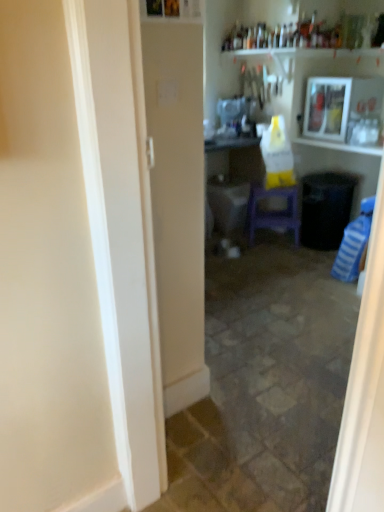
Describe the element at coordinates (273, 212) in the screenshot. I see `purple plastic stool at center` at that location.

Locate an element on the screen. wooden framed picture at upper right is located at coordinates (341, 95).

From a real-world perspective, which is physically below, wooden framed picture at upper right or white glossy sink at center?

white glossy sink at center.

Is wooden framed picture at upper right further to camera compared to white glossy sink at center?

No, the depth of wooden framed picture at upper right is less than that of white glossy sink at center.

Could you tell me if wooden framed picture at upper right is turned towards white glossy sink at center?

No, wooden framed picture at upper right does not turn towards white glossy sink at center.

Is wooden framed picture at upper right located outside white glossy sink at center?

Yes.

Would you say wooden framed picture at upper right is inside or outside purple plastic stool at center?

The correct answer is: outside.

Where is `shelf that appears in front of the purple plastic stool at center`? shelf that appears in front of the purple plastic stool at center is located at coordinates (341, 95).

From a real-world perspective, relative to purple plastic stool at center, is wooden framed picture at upper right vertically above or below?

Clearly, from a real-world perspective, wooden framed picture at upper right is above purple plastic stool at center.

Who is more distant, wooden framed picture at upper right or purple plastic stool at center?

purple plastic stool at center is behind.

From the image's perspective, who appears lower, purple plastic stool at center or wooden framed picture at upper right?

purple plastic stool at center.

In the image, is purple plastic stool at center on the left side or the right side of wooden framed picture at upper right?

purple plastic stool at center is positioned on wooden framed picture at upper right's left side.

Considering the relative sizes of purple plastic stool at center and wooden framed picture at upper right in the image provided, is purple plastic stool at center smaller than wooden framed picture at upper right?

Yes, purple plastic stool at center is smaller than wooden framed picture at upper right.

Is purple plastic stool at center far from wooden framed picture at upper right?

No.

Which is more to the left, white glossy sink at center or purple plastic stool at center?

Positioned to the left is white glossy sink at center.

In the scene shown: Between white glossy sink at center and purple plastic stool at center, which one is positioned behind?

purple plastic stool at center is further away from the camera.

Considering the sizes of objects white glossy sink at center and purple plastic stool at center in the image provided, who is shorter, white glossy sink at center or purple plastic stool at center?

white glossy sink at center.

In the scene shown: Can we say white glossy sink at center lies outside wooden framed picture at upper right?

That's correct, white glossy sink at center is outside of wooden framed picture at upper right.

Can you confirm if white glossy sink at center is positioned to the left of wooden framed picture at upper right?

Indeed, white glossy sink at center is positioned on the left side of wooden framed picture at upper right.

From the image's perspective, is white glossy sink at center above or below wooden framed picture at upper right?

white glossy sink at center is below wooden framed picture at upper right.

Can you confirm if white glossy sink at center is smaller than wooden framed picture at upper right?

Correct, white glossy sink at center occupies less space than wooden framed picture at upper right.

Is there a large distance between purple plastic stool at center and white glossy sink at center?

No, purple plastic stool at center is not far away from white glossy sink at center.

Can you confirm if purple plastic stool at center is positioned to the right of white glossy sink at center?

Correct, you'll find purple plastic stool at center to the right of white glossy sink at center.

Is point (292, 213) in front of point (222, 124)?

Yes, point (292, 213) is in front of point (222, 124).

Find the location of `sink above the purple plastic stool at center (from a real-world perspective)`. sink above the purple plastic stool at center (from a real-world perspective) is located at coordinates coord(234,124).

The width and height of the screenshot is (384, 512). What are the coordinates of `sink on the left side of wooden framed picture at upper right` in the screenshot? It's located at (234, 124).

Identify the location of shelf located in front of the purple plastic stool at center. (341, 95).

Considering their positions, is purple plastic stool at center positioned further to white glossy sink at center than wooden framed picture at upper right?

purple plastic stool at center lies further to white glossy sink at center than the other object.

Which object lies further to the anchor point white glossy sink at center, wooden framed picture at upper right or purple plastic stool at center?

purple plastic stool at center is positioned further to the anchor white glossy sink at center.

Estimate the real-world distances between objects in this image. Which object is further from wooden framed picture at upper right, white glossy sink at center or purple plastic stool at center?

purple plastic stool at center.

Considering their positions, is wooden framed picture at upper right positioned closer to purple plastic stool at center than white glossy sink at center?

Among the two, white glossy sink at center is located nearer to purple plastic stool at center.

Looking at the image, which one is located closer to wooden framed picture at upper right, purple plastic stool at center or white glossy sink at center?

The object closer to wooden framed picture at upper right is white glossy sink at center.

Estimate the real-world distances between objects in this image. Which object is further from purple plastic stool at center, white glossy sink at center or wooden framed picture at upper right?

wooden framed picture at upper right lies further to purple plastic stool at center than the other object.

Where is `sink between wooden framed picture at upper right and purple plastic stool at center from top to bottom`? This screenshot has width=384, height=512. sink between wooden framed picture at upper right and purple plastic stool at center from top to bottom is located at coordinates (234, 124).